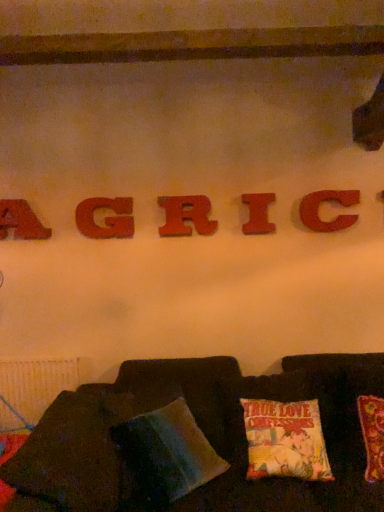
The height and width of the screenshot is (512, 384). I want to click on wooden letter c at center, which ranks as the fifth letter in left-to-right order, so click(324, 202).

This screenshot has width=384, height=512. What do you see at coordinates (186, 215) in the screenshot?
I see `wooden letter r at center, the 3th letter from the left` at bounding box center [186, 215].

What are the coordinates of `matte wooden letter g at center, marked as the second letter in a left-to-right arrangement` in the screenshot? It's located at 106,218.

At what (x,y) coordinates should I click in order to perform the action: click on wooden letter c at center, which is the 1th letter in right-to-left order. Please return your answer as a coordinate pair (x, y). Looking at the image, I should click on (324, 202).

Who is shorter, matte wooden letter g at center, marked as the second letter in a left-to-right arrangement, or wooden letter a at upper left, the 5th letter in the right-to-left sequence?

Standing shorter between the two is wooden letter a at upper left, the 5th letter in the right-to-left sequence.

What's the angular difference between matte wooden letter g at center, which is counted as the 4th letter, starting from the right, and wooden letter a at upper left, the 5th letter in the right-to-left sequence,'s facing directions?

matte wooden letter g at center, which is counted as the 4th letter, starting from the right, and wooden letter a at upper left, the 5th letter in the right-to-left sequence, are facing 0.019 degrees away from each other.

Which of these two, matte wooden letter g at center, which is counted as the 4th letter, starting from the right, or wooden letter a at upper left, the 5th letter in the right-to-left sequence, is wider?

Wider between the two is wooden letter a at upper left, the 5th letter in the right-to-left sequence.

The width and height of the screenshot is (384, 512). Find the location of `letter that is the 5th one when counting upward from the velvet cushion at lower center (from the image's perspective)`. letter that is the 5th one when counting upward from the velvet cushion at lower center (from the image's perspective) is located at coordinates (324, 202).

From the picture: Which object is thinner, velvet cushion at lower center or wooden letter c at center, which is the 1th letter in right-to-left order?

wooden letter c at center, which is the 1th letter in right-to-left order, is thinner.

Is velvet cushion at lower center smaller than wooden letter c at center, which is the 1th letter in right-to-left order?

Actually, velvet cushion at lower center might be larger than wooden letter c at center, which is the 1th letter in right-to-left order.

In the scene shown: From a real-world perspective, who is located higher, velvet cushion at lower center or wooden letter c at center, which is the 1th letter in right-to-left order?

In real-world perspective, wooden letter c at center, which is the 1th letter in right-to-left order, is above.

Considering the sizes of velvet cushion at lower center and wooden letter a at upper left, the first letter viewed from the left, in the image, is velvet cushion at lower center taller or shorter than wooden letter a at upper left, the first letter viewed from the left,?

In the image, velvet cushion at lower center appears to be taller than wooden letter a at upper left, the first letter viewed from the left.

How far apart are velvet cushion at lower center and wooden letter a at upper left, the 5th letter in the right-to-left sequence?

The distance of velvet cushion at lower center from wooden letter a at upper left, the 5th letter in the right-to-left sequence, is 1.38 meters.

The width and height of the screenshot is (384, 512). What are the coordinates of `furniture that is under the wooden letter a at upper left, the 5th letter in the right-to-left sequence (from a real-world perspective)` in the screenshot? It's located at (204, 439).

Is wooden letter r at center, the 3th letter from the left, taller or shorter than velvet cushion at lower center?

Clearly, wooden letter r at center, the 3th letter from the left, is shorter compared to velvet cushion at lower center.

Is wooden letter r at center, the 3th letter from the left, oriented away from velvet cushion at lower center?

No, velvet cushion at lower center is not at the back of wooden letter r at center, the 3th letter from the left.

Can you confirm if wooden letter r at center, the third letter from the right, is positioned to the right of velvet cushion at lower center?

No.

How much distance is there between wooden letter r at center, the third letter from the right, and velvet cushion at lower center?

wooden letter r at center, the third letter from the right, is 3.47 feet away from velvet cushion at lower center.

Is matte wooden letter g at center, which is counted as the 4th letter, starting from the right, taller than wooden letter r at center, the third letter from the right?

Incorrect, the height of matte wooden letter g at center, which is counted as the 4th letter, starting from the right, is not larger of that of wooden letter r at center, the third letter from the right.

Can you confirm if matte wooden letter g at center, marked as the second letter in a left-to-right arrangement, is bigger than wooden letter r at center, the third letter from the right?

Actually, matte wooden letter g at center, marked as the second letter in a left-to-right arrangement, might be smaller than wooden letter r at center, the third letter from the right.

Considering the relative sizes of matte wooden letter g at center, marked as the second letter in a left-to-right arrangement, and wooden letter r at center, the third letter from the right, in the image provided, is matte wooden letter g at center, marked as the second letter in a left-to-right arrangement, wider than wooden letter r at center, the third letter from the right,?

Yes.

Does point (130, 220) appear closer or farther from the camera than point (206, 208)?

Clearly, point (130, 220) is more distant from the camera than point (206, 208).

Which point is more distant from viewer, (255, 210) or (2, 231)?

Positioned behind is point (2, 231).

Is matte wood letter i at center, the fourth letter when ordered from left to right, shorter than wooden letter a at upper left, the 5th letter in the right-to-left sequence?

Yes.

Is matte wood letter i at center, the fourth letter when ordered from left to right, bigger or smaller than wooden letter a at upper left, the 5th letter in the right-to-left sequence?

Considering their sizes, matte wood letter i at center, the fourth letter when ordered from left to right, takes up less space than wooden letter a at upper left, the 5th letter in the right-to-left sequence.

From the image's perspective, is wooden letter r at center, the 3th letter from the left, on wooden letter c at center, which is the 1th letter in right-to-left order?

Actually, wooden letter r at center, the 3th letter from the left, appears below wooden letter c at center, which is the 1th letter in right-to-left order, in the image.

Between wooden letter r at center, the third letter from the right, and wooden letter c at center, which is the 1th letter in right-to-left order, which one is positioned behind?

Positioned behind is wooden letter r at center, the third letter from the right.

Where is `the 2nd letter counting from the left side of the wooden letter c at center, which ranks as the fifth letter in left-to-right order`? The width and height of the screenshot is (384, 512). the 2nd letter counting from the left side of the wooden letter c at center, which ranks as the fifth letter in left-to-right order is located at coordinates (186, 215).

Image resolution: width=384 pixels, height=512 pixels. I want to click on letter located on the left of matte wooden letter g at center, marked as the second letter in a left-to-right arrangement, so click(x=21, y=221).

Locate an element on the screen. The height and width of the screenshot is (512, 384). letter that is the 1st object located behind the velvet cushion at lower center is located at coordinates (324, 202).

When comparing their distances from multicolored fabric pillow at lower center, does wooden letter r at center, the 3th letter from the left, or wooden letter c at center, which is the 1th letter in right-to-left order, seem closer?

wooden letter r at center, the 3th letter from the left, is closer to multicolored fabric pillow at lower center.

Considering their positions, is wooden letter r at center, the 3th letter from the left, positioned closer to matte wood letter i at center, the fourth letter when ordered from left to right, than matte wooden letter g at center, which is counted as the 4th letter, starting from the right?

wooden letter r at center, the 3th letter from the left, is closer to matte wood letter i at center, the fourth letter when ordered from left to right.

Based on their spatial positions, is wooden letter c at center, which ranks as the fifth letter in left-to-right order, or velvet cushion at lower center closer to wooden letter r at center, the third letter from the right?

Among the two, wooden letter c at center, which ranks as the fifth letter in left-to-right order, is located nearer to wooden letter r at center, the third letter from the right.

Which object lies further to the anchor point matte wood letter i at center, which appears as the 2th letter when viewed from the right, matte wooden letter g at center, which is counted as the 4th letter, starting from the right, or wooden letter a at upper left, the 5th letter in the right-to-left sequence?

The object further to matte wood letter i at center, which appears as the 2th letter when viewed from the right, is wooden letter a at upper left, the 5th letter in the right-to-left sequence.

Considering their positions, is wooden letter c at center, which ranks as the fifth letter in left-to-right order, positioned closer to wooden letter r at center, the third letter from the right, than multicolored fabric pillow at lower center?

wooden letter c at center, which ranks as the fifth letter in left-to-right order, lies closer to wooden letter r at center, the third letter from the right, than the other object.

Looking at the image, which one is located closer to multicolored fabric pillow at lower center, wooden letter a at upper left, the first letter viewed from the left, or matte wooden letter g at center, marked as the second letter in a left-to-right arrangement?

matte wooden letter g at center, marked as the second letter in a left-to-right arrangement.

When comparing their distances from wooden letter a at upper left, the first letter viewed from the left, does matte wooden letter g at center, marked as the second letter in a left-to-right arrangement, or multicolored fabric pillow at lower center seem further?

multicolored fabric pillow at lower center.

Based on their spatial positions, is matte wood letter i at center, which appears as the 2th letter when viewed from the right, or wooden letter a at upper left, the 5th letter in the right-to-left sequence, further from velvet cushion at lower center?

wooden letter a at upper left, the 5th letter in the right-to-left sequence.

Image resolution: width=384 pixels, height=512 pixels. In order to click on letter between wooden letter r at center, the 3th letter from the left, and wooden letter c at center, which ranks as the fifth letter in left-to-right order, in the horizontal direction in this screenshot , I will do `click(258, 213)`.

Find the location of a particular element. pillow located between wooden letter a at upper left, the first letter viewed from the left, and wooden letter c at center, which ranks as the fifth letter in left-to-right order, in the left-right direction is located at coordinates (167, 453).

Locate an element on the screen. pillow between wooden letter c at center, which is the 1th letter in right-to-left order, and velvet cushion at lower center vertically is located at coordinates (167, 453).

Identify the location of furniture located between wooden letter a at upper left, the 5th letter in the right-to-left sequence, and wooden letter c at center, which ranks as the fifth letter in left-to-right order, in the left-right direction. (204, 439).